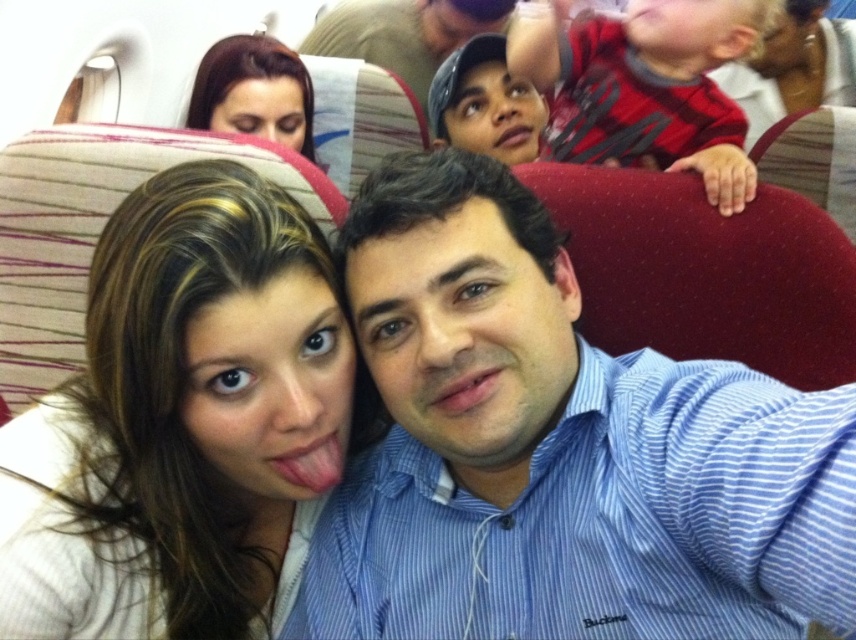
You are a GUI agent. You are given a task and a screenshot of the screen. Output one action in this format:
    pyautogui.click(x=<x>, y=<y>)
    Task: Click on the smooth white shirt at center
    The width and height of the screenshot is (856, 640).
    Given the screenshot: What is the action you would take?
    pyautogui.click(x=187, y=420)

Is point (286, 593) in front of point (604, 144)?

That is True.

Where is `smooth white shirt at center`? smooth white shirt at center is located at coordinates [187, 420].

Looking at this image, does smooth white shirt at center have a greater height compared to smooth brown hair at upper left?

Yes, smooth white shirt at center is taller than smooth brown hair at upper left.

Does smooth white shirt at center appear over smooth brown hair at upper left?

Incorrect, smooth white shirt at center is not positioned above smooth brown hair at upper left.

Where is `smooth white shirt at center`? The image size is (856, 640). smooth white shirt at center is located at coordinates (187, 420).

Does blue striped shirt at center appear under smooth brown hair at upper left?

Yes.

Does blue striped shirt at center appear over smooth brown hair at upper left?

Actually, blue striped shirt at center is below smooth brown hair at upper left.

Where is `blue striped shirt at center`? blue striped shirt at center is located at coordinates (557, 451).

You are a GUI agent. You are given a task and a screenshot of the screen. Output one action in this format:
    pyautogui.click(x=<x>, y=<y>)
    Task: Click on the blue striped shirt at center
    The width and height of the screenshot is (856, 640).
    Given the screenshot: What is the action you would take?
    pyautogui.click(x=557, y=451)